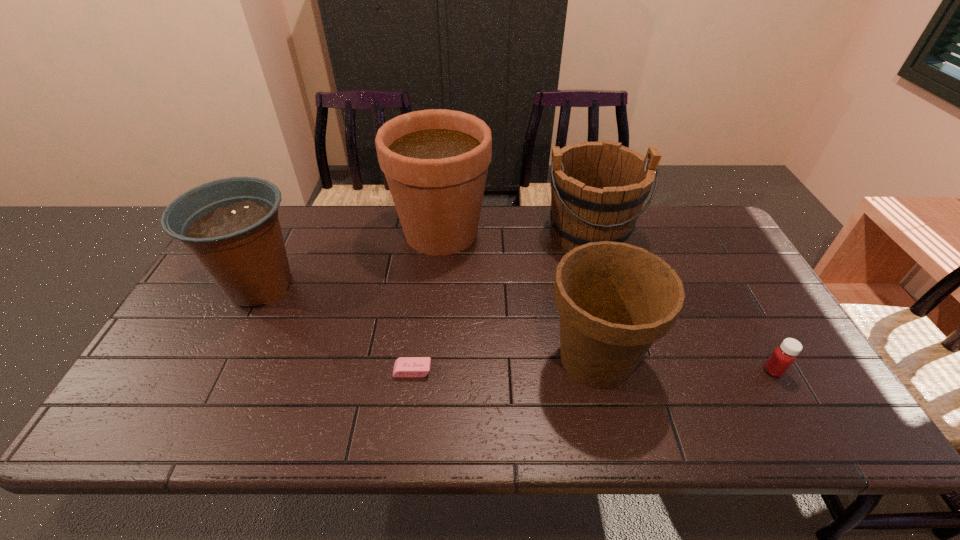
This screenshot has height=540, width=960. Identify the location of flowerpot present at the far edge. (605, 387).

Find the location of a particular element. Image resolution: width=960 pixels, height=540 pixels. wine bucket that is positioned at the far edge is located at coordinates 509,242.

Image resolution: width=960 pixels, height=540 pixels. What are the coordinates of `object that is at the near edge` in the screenshot? It's located at (246, 330).

I want to click on object located in the left edge section of the desktop, so (x=681, y=226).

At what (x,y) coordinates should I click in order to perform the action: click on free space at the far edge of the desktop. Please return your answer as a coordinate pair (x, y). The height and width of the screenshot is (540, 960). Looking at the image, I should click on (305, 247).

What are the coordinates of `free space at the near edge of the desktop` in the screenshot? It's located at (439, 434).

Locate an element on the screen. This screenshot has width=960, height=540. free space at the left edge is located at coordinates (228, 274).

Image resolution: width=960 pixels, height=540 pixels. Identify the location of vacant space at the right edge of the desktop. tap(723, 289).

At what (x,y) coordinates should I click in order to perform the action: click on free space at the far left corner of the desktop. Please return your answer as a coordinate pair (x, y). Looking at the image, I should click on (279, 212).

You are a GUI agent. You are given a task and a screenshot of the screen. Output one action in this format:
    pyautogui.click(x=<x>, y=<y>)
    Task: Click on the free space at the near right corner of the desktop
    
    Given the screenshot: What is the action you would take?
    pyautogui.click(x=796, y=431)